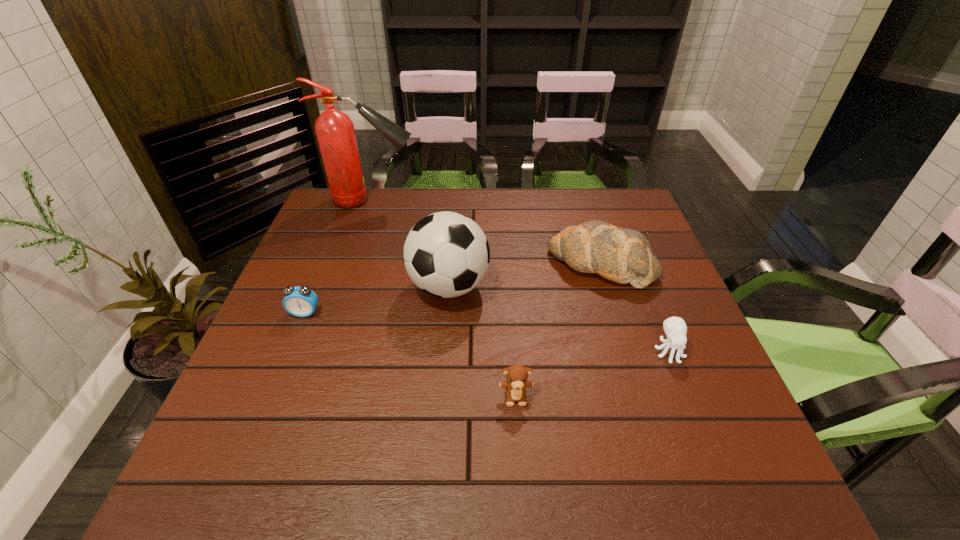
This screenshot has height=540, width=960. Find the location of `vacant region that satisfies the following two spatial constraints: 1. at the nozzle end of the fire extinguisher; 2. on the face of the alarm clock`. vacant region that satisfies the following two spatial constraints: 1. at the nozzle end of the fire extinguisher; 2. on the face of the alarm clock is located at coordinates (334, 313).

Where is `free space that satisfies the following two spatial constraints: 1. on the back side of the fourth shortest object; 2. on the right side of the soccer ball`? The width and height of the screenshot is (960, 540). free space that satisfies the following two spatial constraints: 1. on the back side of the fourth shortest object; 2. on the right side of the soccer ball is located at coordinates (450, 264).